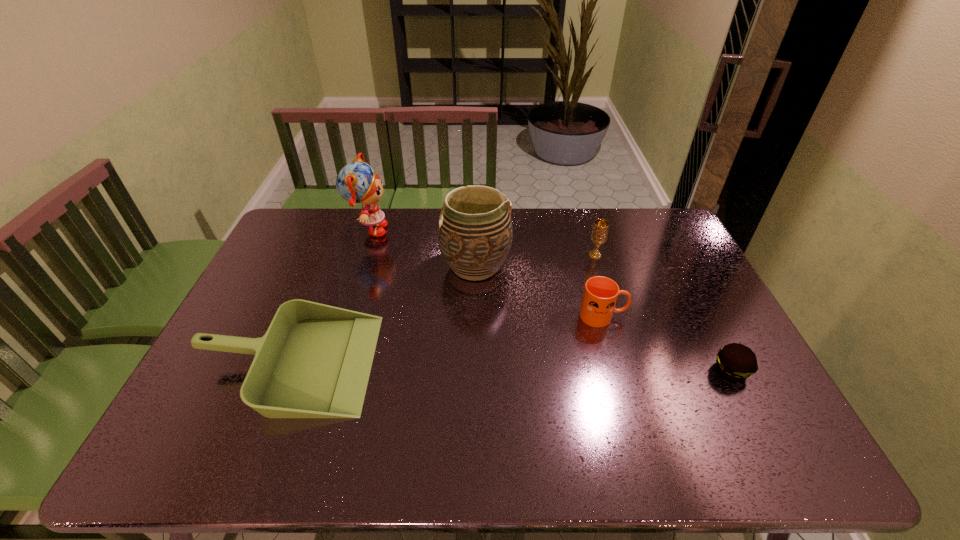
Image resolution: width=960 pixels, height=540 pixels. I want to click on vacant space that's between the doll and the third object from left to right, so click(422, 248).

Locate an element on the screen. This screenshot has width=960, height=540. free spot between the pottery and the chalice is located at coordinates (535, 261).

This screenshot has width=960, height=540. In order to click on object that can be found as the fifth closest to the chalice in this screenshot , I will do `click(314, 361)`.

Identify the location of object that ranks as the closest to the pottery. The width and height of the screenshot is (960, 540). (314, 361).

Image resolution: width=960 pixels, height=540 pixels. What are the coordinates of `vacant region that satisfies the following two spatial constraints: 1. on the face of the doll; 2. on the back side of the shortest object` in the screenshot? It's located at (x=324, y=370).

Locate an element on the screen. This screenshot has height=540, width=960. free location that satisfies the following two spatial constraints: 1. on the back side of the patty; 2. on the scoop of the dustpan is located at coordinates (728, 362).

You are a GUI agent. You are given a task and a screenshot of the screen. Output one action in this format:
    pyautogui.click(x=<x>, y=<y>)
    Task: Click on the vacant space that satisfies the following two spatial constraints: 1. on the face of the doll; 2. on the left side of the pottery
    This screenshot has width=960, height=540.
    Given the screenshot: What is the action you would take?
    pyautogui.click(x=357, y=266)

You are a GUI agent. You are given a task and a screenshot of the screen. Output one action in this format:
    pyautogui.click(x=<x>, y=<y>)
    Task: Click on the blank area in the image that satisfies the following two spatial constraints: 1. on the face of the third object from left to right; 2. on the right side of the doll
    
    Given the screenshot: What is the action you would take?
    pyautogui.click(x=357, y=266)

Where is `blank area in the image that satisfies the following two spatial constraints: 1. on the face of the chalice; 2. on the right side of the doll`? Image resolution: width=960 pixels, height=540 pixels. blank area in the image that satisfies the following two spatial constraints: 1. on the face of the chalice; 2. on the right side of the doll is located at coordinates (361, 255).

Find the location of `free point that satisfies the following two spatial constraints: 1. on the handle side of the patty; 2. on the right side of the mug`. free point that satisfies the following two spatial constraints: 1. on the handle side of the patty; 2. on the right side of the mug is located at coordinates (617, 370).